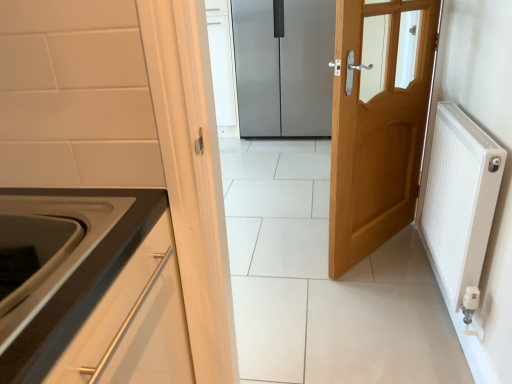
The width and height of the screenshot is (512, 384). Identify the location of empty space that is ontop of white ribbed radiator at right (from a real-world perspective). (468, 120).